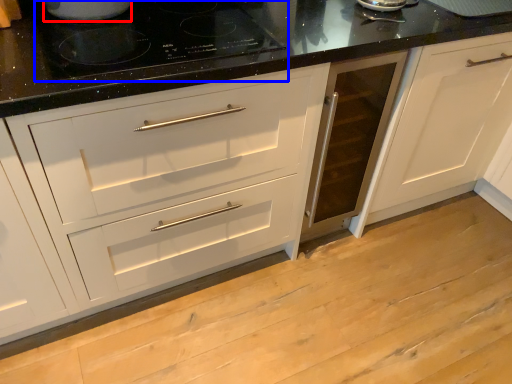
Question: Which point is closer to the camera, appliance (highlighted by a red box) or gas stove (highlighted by a blue box)?

Choices:
 (A) appliance
 (B) gas stove

Answer: (B)